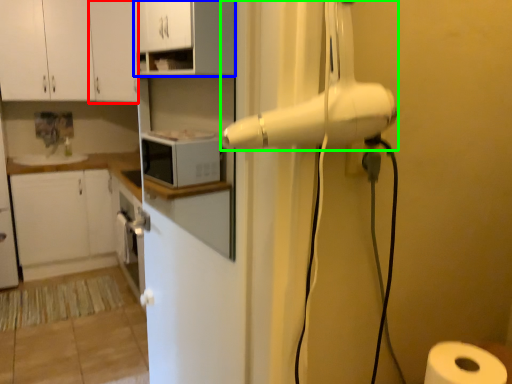
Question: Estimate the real-world distances between objects in this image. Which object is closer to cabinetry (highlighted by a red box), cabinetry (highlighted by a blue box) or home appliance (highlighted by a green box)?

Choices:
 (A) cabinetry
 (B) home appliance

Answer: (A)